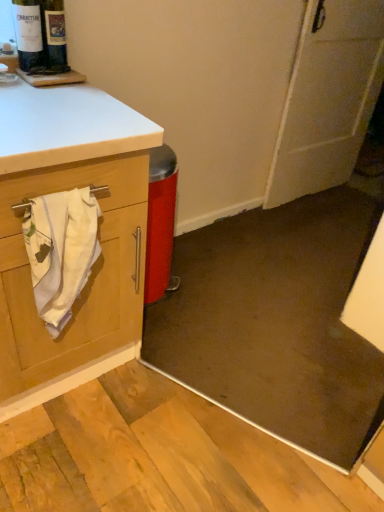
Question: Would you say white cotton towel at left is part of white matte door at upper right's contents?

Choices:
 (A) no
 (B) yes

Answer: (A)

Question: Is white matte door at upper right facing away from white cotton towel at left?

Choices:
 (A) no
 (B) yes

Answer: (A)

Question: Is white matte door at upper right outside of white cotton towel at left?

Choices:
 (A) yes
 (B) no

Answer: (A)

Question: Is white matte door at upper right wider than white cotton towel at left?

Choices:
 (A) no
 (B) yes

Answer: (B)

Question: Is white matte door at upper right oriented towards white cotton towel at left?

Choices:
 (A) no
 (B) yes

Answer: (A)

Question: Is point (322, 178) closer or farther from the camera than point (82, 215)?

Choices:
 (A) farther
 (B) closer

Answer: (A)

Question: Is white matte door at upper right to the left or to the right of white cotton towel at left in the image?

Choices:
 (A) right
 (B) left

Answer: (A)

Question: From a real-world perspective, is white matte door at upper right physically located above or below white cotton towel at left?

Choices:
 (A) above
 (B) below

Answer: (A)

Question: Looking at the image, does white matte door at upper right seem bigger or smaller compared to white cotton towel at left?

Choices:
 (A) small
 (B) big

Answer: (B)

Question: From the image's perspective, relative to white matte door at upper right, is matte glass bottle at upper left above or below?

Choices:
 (A) above
 (B) below

Answer: (B)

Question: Is point (66, 58) positioned closer to the camera than point (329, 53)?

Choices:
 (A) farther
 (B) closer

Answer: (B)

Question: From a real-world perspective, is matte glass bottle at upper left above or below white matte door at upper right?

Choices:
 (A) below
 (B) above

Answer: (B)

Question: In terms of size, does matte glass bottle at upper left appear bigger or smaller than white matte door at upper right?

Choices:
 (A) big
 (B) small

Answer: (B)

Question: Considering the positions of white cotton towel at left and matte glass bottle at upper left in the image, is white cotton towel at left taller or shorter than matte glass bottle at upper left?

Choices:
 (A) tall
 (B) short

Answer: (A)

Question: Which is correct: white cotton towel at left is inside matte glass bottle at upper left, or outside of it?

Choices:
 (A) inside
 (B) outside

Answer: (B)